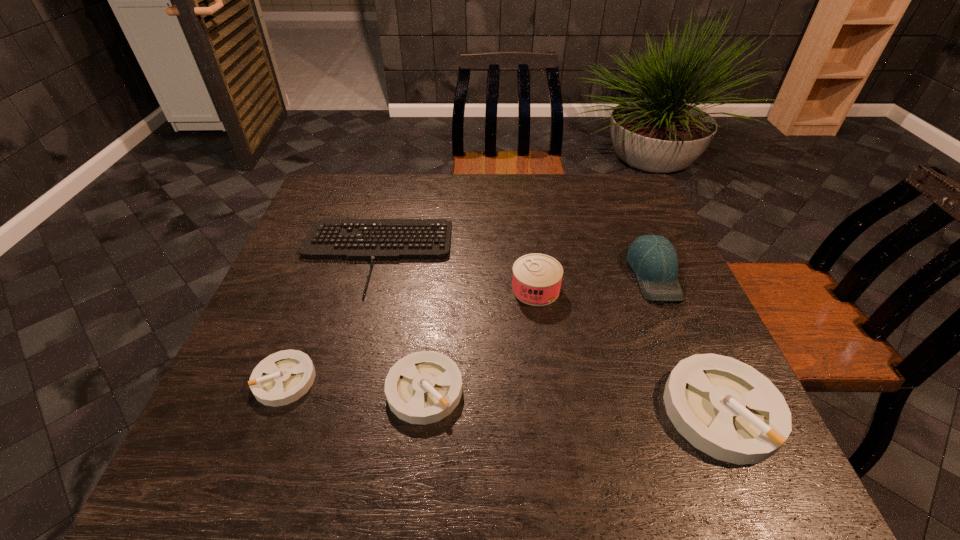
You are a GUI agent. You are given a task and a screenshot of the screen. Output one action in this format:
    pyautogui.click(x=<x>, y=<y>)
    Task: Click on the vacant space that is in between the shortest ashtray and the can
    
    Given the screenshot: What is the action you would take?
    410,335

Locate an element on the screen. This screenshot has height=540, width=960. vacant area between the third shortest object and the fourth shortest object is located at coordinates (573, 400).

In order to click on free space that is in between the third tallest object and the computer keyboard in this screenshot , I will do coord(548,333).

I want to click on vacant region between the can and the second ashtray from left to right, so [x=480, y=340].

Identify which object is the fifth nearest to the rightmost ashtray. Please provide its 2D coordinates. Your answer should be formatted as a tuple, i.e. [(x, y)], where the tuple contains the x and y coordinates of a point satisfying the conditions above.

[(281, 378)]

What are the coordinates of `the second closest object to the rightmost ashtray` in the screenshot? It's located at (536, 281).

The width and height of the screenshot is (960, 540). Identify the location of the closest ashtray relative to the second ashtray from right to left. (281, 378).

You are a GUI agent. You are given a task and a screenshot of the screen. Output one action in this format:
    pyautogui.click(x=<x>, y=<y>)
    Task: Click on the ashtray that is the nearest to the third tallest object
    This screenshot has height=540, width=960.
    Given the screenshot: What is the action you would take?
    pos(424,387)

I want to click on vacant point that satisfies the following two spatial constraints: 1. on the front side of the third tallest object; 2. on the left side of the shortest ashtray, so click(x=274, y=410).

This screenshot has width=960, height=540. What are the coordinates of `vacant space that satisfies the following two spatial constraints: 1. on the back side of the fourth object from left to right; 2. on the left side of the second ashtray from left to right` in the screenshot? It's located at (435, 289).